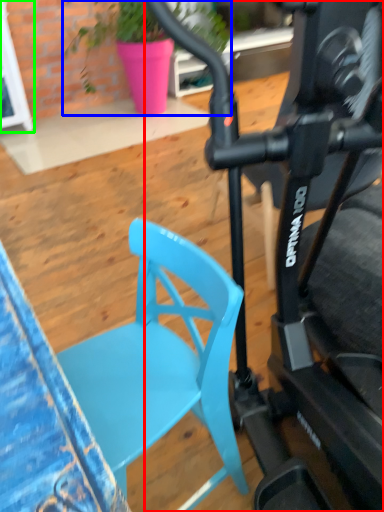
Question: Which is nearer to the bicycle (highlighted by a red box)? houseplant (highlighted by a blue box) or glass door (highlighted by a green box).

Choices:
 (A) houseplant
 (B) glass door

Answer: (A)